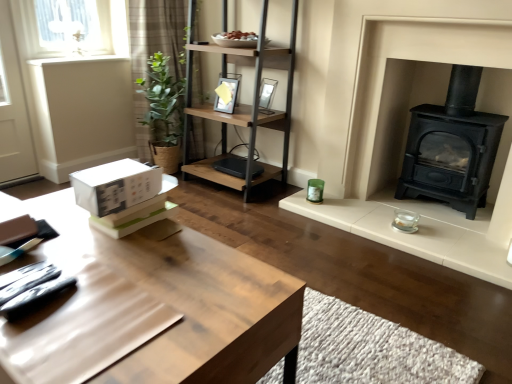
Question: Is the surface of matte glass picture frame at upper center, placed as the first picture frame when sorted from right to left, in direct contact with black cast iron wood burning stove at right?

Choices:
 (A) yes
 (B) no

Answer: (B)

Question: Is black cast iron wood burning stove at right inside matte glass picture frame at upper center, placed as the first picture frame when sorted from right to left?

Choices:
 (A) no
 (B) yes

Answer: (A)

Question: Is the depth of matte glass picture frame at upper center, placed as the 2th picture frame when sorted from left to right, less than that of black cast iron wood burning stove at right?

Choices:
 (A) yes
 (B) no

Answer: (B)

Question: Can you confirm if matte glass picture frame at upper center, placed as the first picture frame when sorted from right to left, is thinner than black cast iron wood burning stove at right?

Choices:
 (A) yes
 (B) no

Answer: (A)

Question: Is matte glass picture frame at upper center, placed as the 2th picture frame when sorted from left to right, bigger than black cast iron wood burning stove at right?

Choices:
 (A) yes
 (B) no

Answer: (B)

Question: Considering the relative sizes of matte glass picture frame at upper center, placed as the first picture frame when sorted from right to left, and black cast iron wood burning stove at right in the image provided, is matte glass picture frame at upper center, placed as the first picture frame when sorted from right to left, shorter than black cast iron wood burning stove at right?

Choices:
 (A) no
 (B) yes

Answer: (B)

Question: Is brown plaid curtain at upper left shorter than woodenmaterial/textureshelf at center?

Choices:
 (A) yes
 (B) no

Answer: (B)

Question: From the image's perspective, is brown plaid curtain at upper left on top of woodenmaterial/textureshelf at center?

Choices:
 (A) yes
 (B) no

Answer: (A)

Question: Can you confirm if brown plaid curtain at upper left is taller than woodenmaterial/textureshelf at center?

Choices:
 (A) yes
 (B) no

Answer: (A)

Question: Can you confirm if brown plaid curtain at upper left is thinner than woodenmaterial/textureshelf at center?

Choices:
 (A) yes
 (B) no

Answer: (A)

Question: Is brown plaid curtain at upper left smaller than woodenmaterial/textureshelf at center?

Choices:
 (A) yes
 (B) no

Answer: (A)

Question: Is brown plaid curtain at upper left at the right side of woodenmaterial/textureshelf at center?

Choices:
 (A) yes
 (B) no

Answer: (B)

Question: Is matte black picture frame at upper center, the second picture frame when ordered from right to left, looking in the opposite direction of light brown wooden table at center?

Choices:
 (A) yes
 (B) no

Answer: (B)